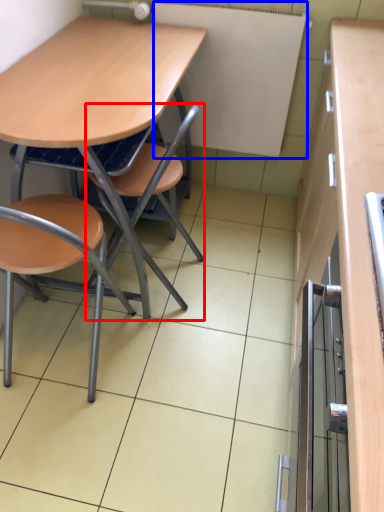
Question: Which of the following is the farthest to the observer, chair (highlighted by a red box) or bulletin board (highlighted by a blue box)?

Choices:
 (A) chair
 (B) bulletin board

Answer: (B)